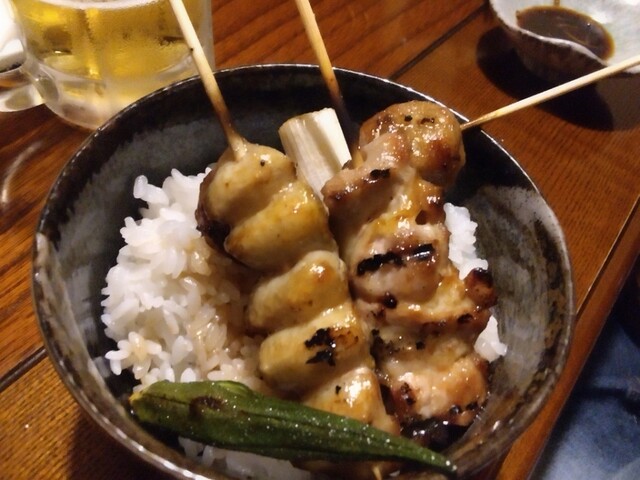
Locate an element on the screen. bowl is located at coordinates (534, 352).